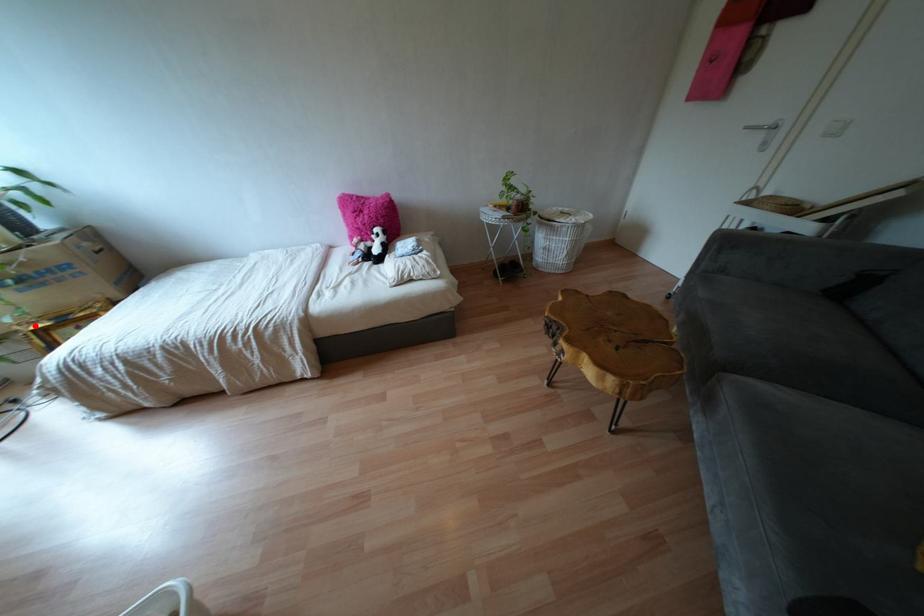
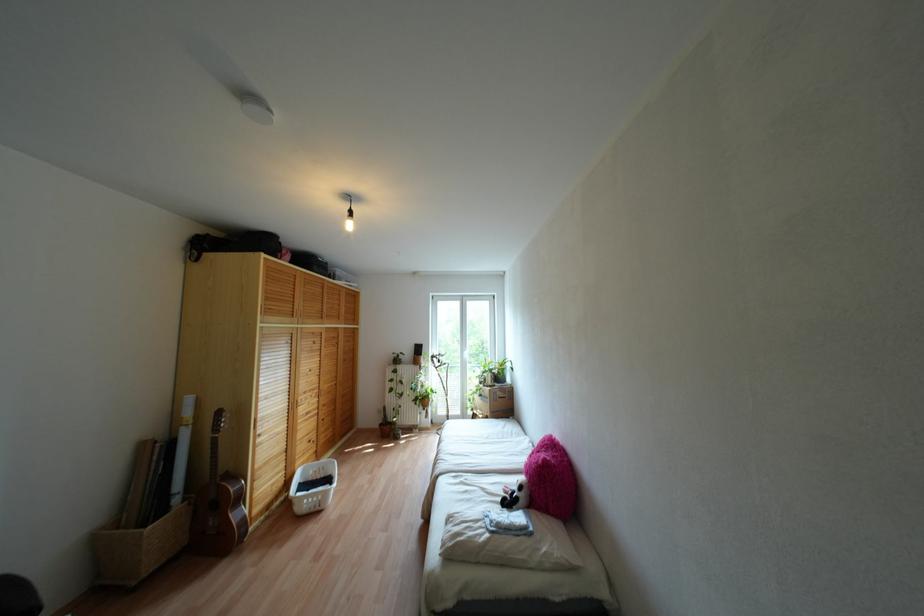
Question: A red point is marked in image1. In image2, is the corresponding 3D point closer to the camera or farther? Reply with the corresponding letter.

Choices:
 (A) The corresponding 3D point is closer.
 (B) The corresponding 3D point is farther.

Answer: (B)